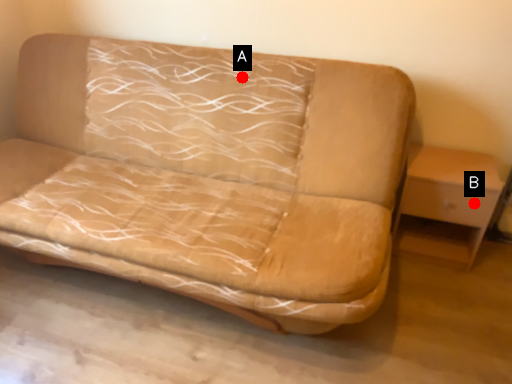
Question: Two points are circled on the image, labeled by A and B beside each circle. Which point is closer to the camera taking this photo?

Choices:
 (A) A is closer
 (B) B is closer

Answer: (B)